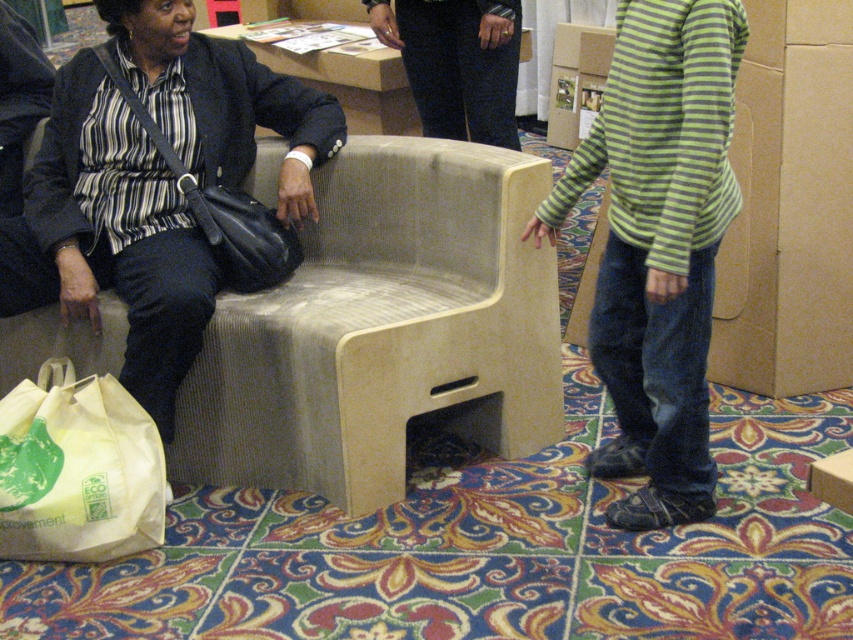
Question: Is green striped sweater at center smaller than white paper bag at lower left?

Choices:
 (A) no
 (B) yes

Answer: (A)

Question: Among these objects, which one is nearest to the camera?

Choices:
 (A) black leather bag at left
 (B) matte black purse at left
 (C) green striped sweater at center

Answer: (C)

Question: Which point is closer to the camera taking this photo?

Choices:
 (A) click(136, 330)
 (B) click(148, 532)

Answer: (B)

Question: Does white paper bag at lower left appear on the left side of dark blue jeans at center?

Choices:
 (A) no
 (B) yes

Answer: (B)

Question: Among these points, which one is farthest from the camera?

Choices:
 (A) (263, 237)
 (B) (438, 88)

Answer: (B)

Question: Can you confirm if matte black purse at left is wider than black leather bag at left?

Choices:
 (A) no
 (B) yes

Answer: (B)